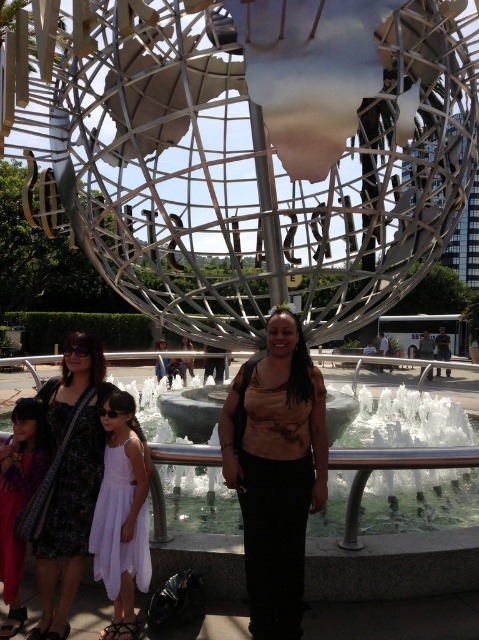
Question: Can you confirm if white marble fountain at center is bigger than matte purple dress at lower left?

Choices:
 (A) no
 (B) yes

Answer: (B)

Question: Among these points, which one is farthest from the camera?

Choices:
 (A) (7, 556)
 (B) (295, 330)
 (C) (93, 476)

Answer: (B)

Question: Which point appears closest to the camera in this image?

Choices:
 (A) (253, 589)
 (B) (138, 454)

Answer: (A)

Question: Does brown matte shirt at center have a larger size compared to dark floral dress at lower left?

Choices:
 (A) yes
 (B) no

Answer: (A)

Question: Which is nearer to the dark floral dress at lower left?

Choices:
 (A) white chiffon dress at center
 (B) white marble fountain at center

Answer: (A)

Question: Can you confirm if brown matte shirt at center is positioned to the left of white chiffon dress at center?

Choices:
 (A) no
 (B) yes

Answer: (A)